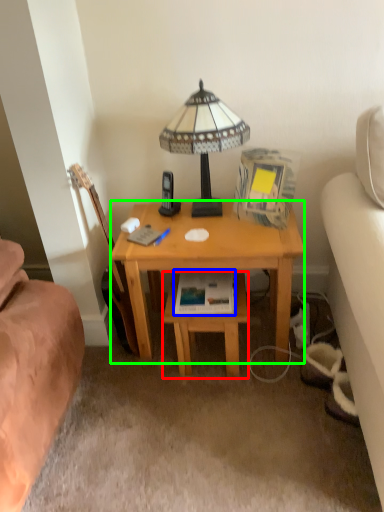
Question: Based on their relative distances, which object is farther from table (highlighted by a red box)? Choose from paperback book (highlighted by a blue box) and desk (highlighted by a green box).

Choices:
 (A) paperback book
 (B) desk

Answer: (B)